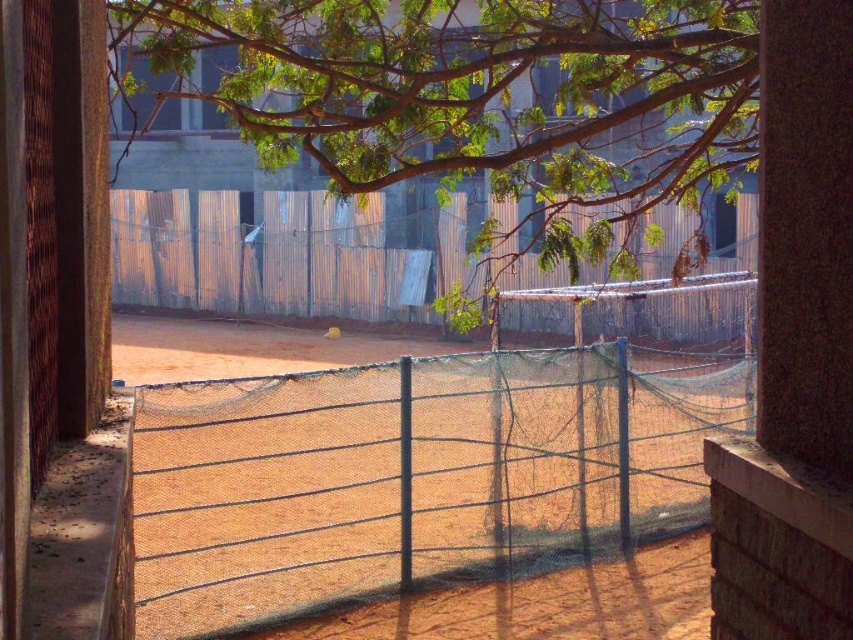
Looking at this image, you are standing inside a building looking through a doorway. You see a green mesh tennis net at center and a green leafy tree at upper center. Which object takes up more space in the view?

The green leafy tree at upper center takes up more space in the view because it is larger than the green mesh tennis net at center.

You are standing inside a building and looking through a doorway. You see a green leafy tree at upper center and a rusty corrugated metal fence at center. Which object is nearer to you?

The green leafy tree at upper center is closer to the viewer than the rusty corrugated metal fence at center.

You are standing inside a building looking through a doorway. You see two points marked in the scene. The first point is at coordinate point (322,582) and the second is at point (341,106). Which point is closer to you?

Point (322,582) is in front of point (341,106), so it is closer to you.